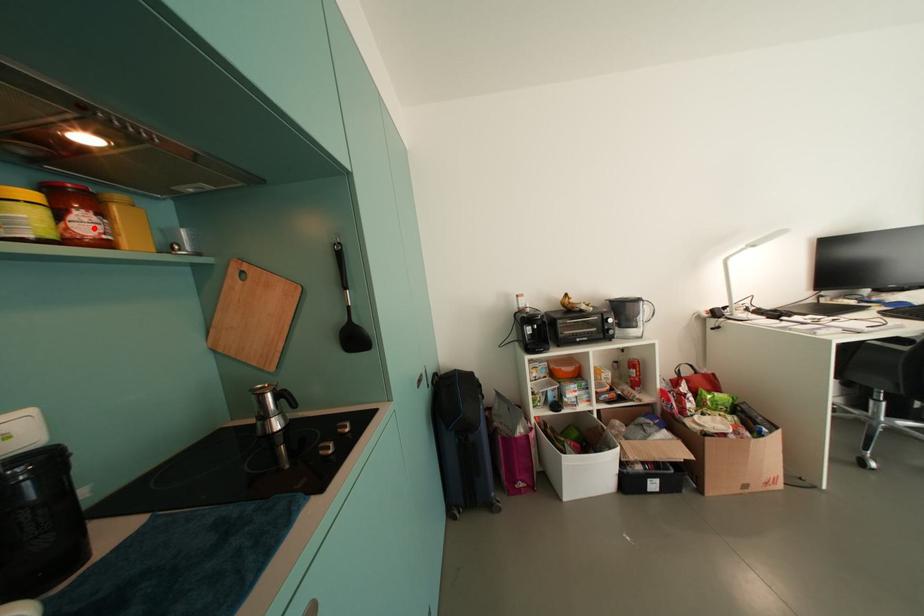
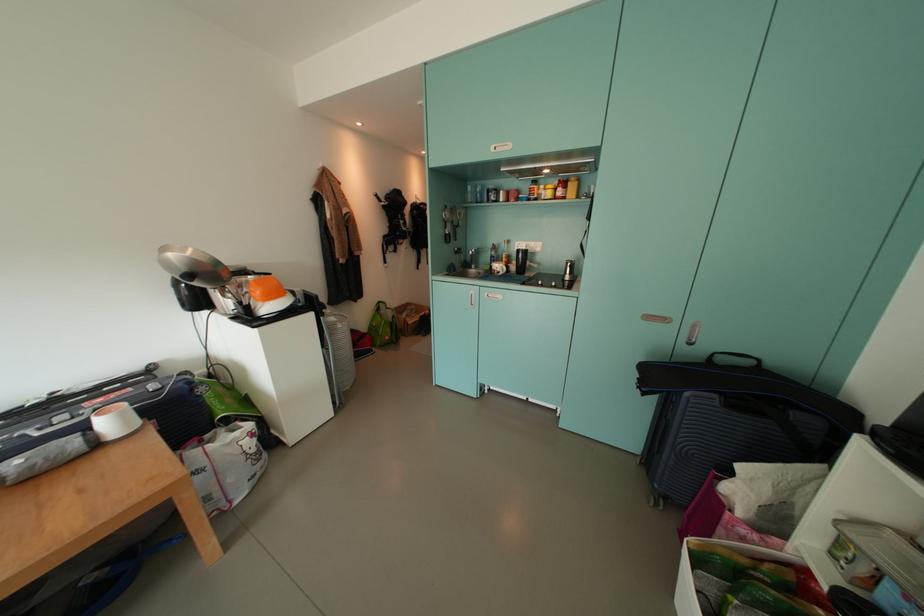
Find the pixel in the second image that matches the highlighted location in the first image.

(566, 195)